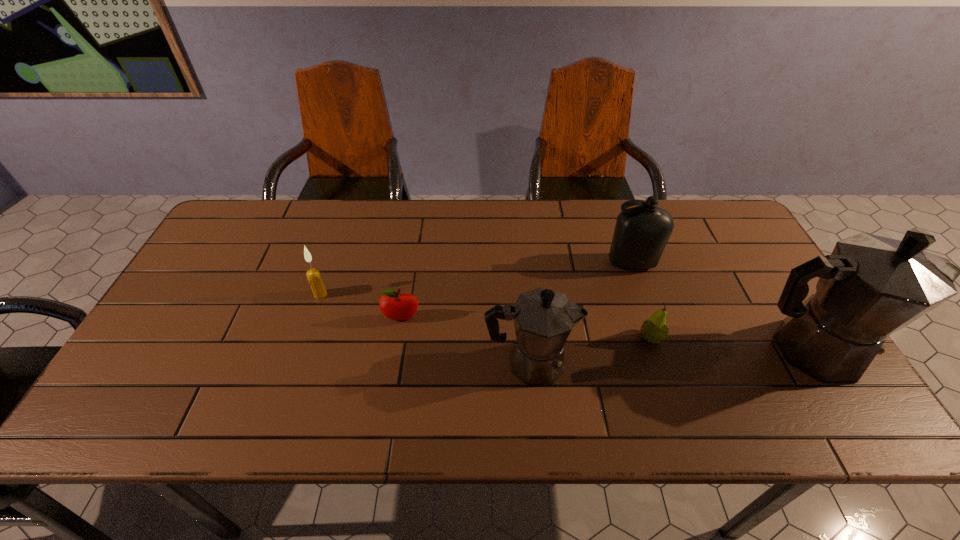
Locate an element on the screen. The image size is (960, 540). blank space located on the left of the third shortest object is located at coordinates (183, 294).

Find the location of a particular element. The width and height of the screenshot is (960, 540). blank space located on the front of the bottle is located at coordinates (662, 354).

Find the location of a particular element. This screenshot has height=540, width=960. free region located on the front of the fifth object from right to left is located at coordinates (392, 383).

Where is `vacant area located on the left of the pear`? This screenshot has width=960, height=540. vacant area located on the left of the pear is located at coordinates (495, 338).

Locate an element on the screen. The width and height of the screenshot is (960, 540). object located in the right edge section of the desktop is located at coordinates (871, 286).

Image resolution: width=960 pixels, height=540 pixels. I want to click on object that is at the near right corner, so click(871, 286).

In the image, there is a desktop. Where is `free space at the far edge`? free space at the far edge is located at coordinates (334, 213).

Image resolution: width=960 pixels, height=540 pixels. Find the location of `blank space at the near edge`. blank space at the near edge is located at coordinates (671, 377).

Image resolution: width=960 pixels, height=540 pixels. What are the coordinates of `vacant space at the left edge of the desktop` in the screenshot? It's located at (171, 353).

I want to click on vacant space that is in between the bottle and the pear, so click(x=641, y=301).